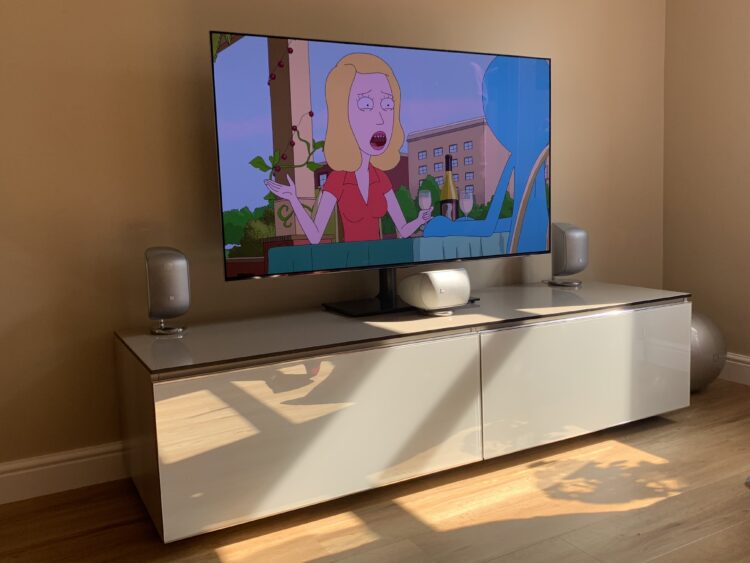
At what (x,y) coordinates should I click in order to perform the action: click on walls. Please return your answer as a coordinate pair (x, y). Image resolution: width=750 pixels, height=563 pixels. Looking at the image, I should click on (598, 87), (702, 92).